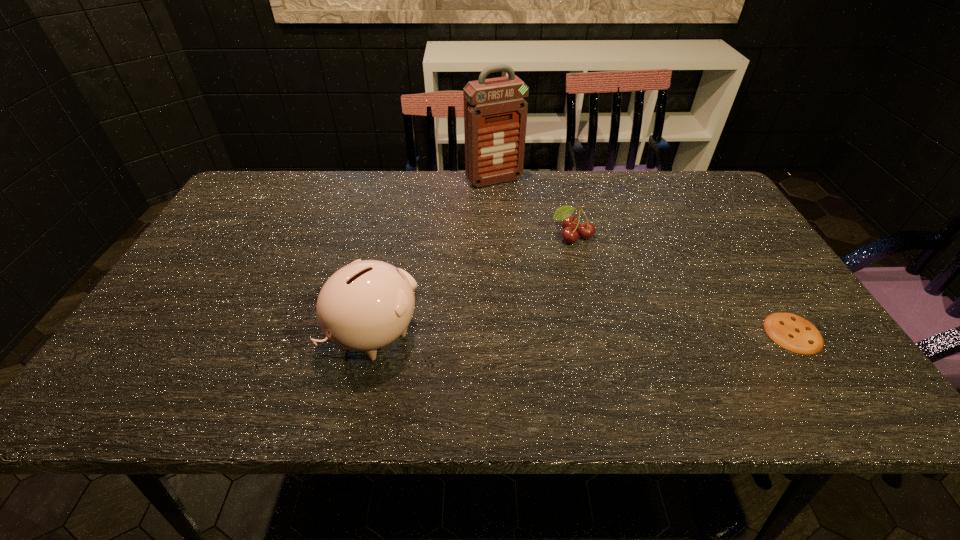
Find the location of a particular element. This screenshot has width=960, height=540. vacant space on the desktop that is between the leftmost object and the rightmost object and is positioned on the leaves of the third nearest object is located at coordinates (578, 333).

Identify the location of vacant spot on the desktop that is between the piggy bank and the cookie and is positioned on the front-facing side of the first-aid kit. coord(608,333).